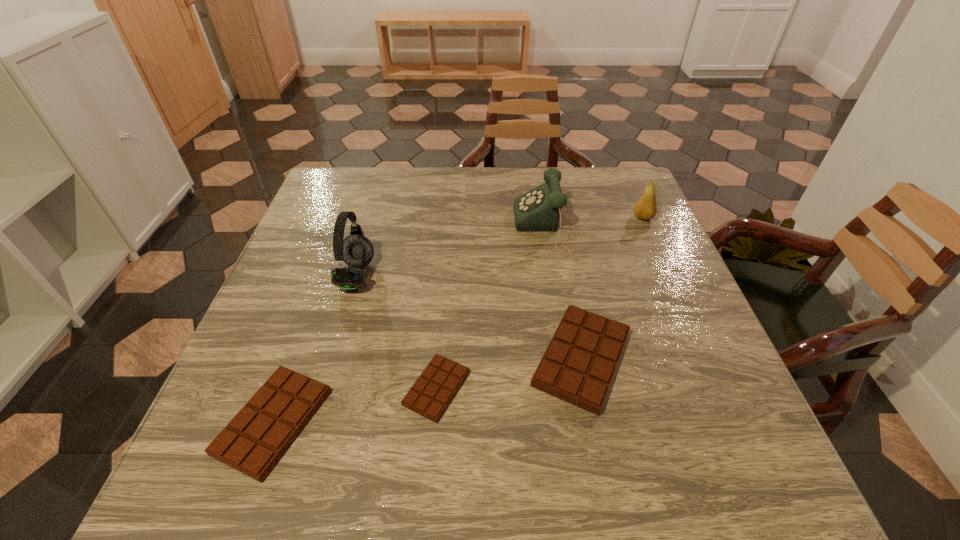
Locate an element on the screen. This screenshot has width=960, height=540. the second tallest candy bar is located at coordinates (253, 442).

Where is `the second shortest object`? The height and width of the screenshot is (540, 960). the second shortest object is located at coordinates (253, 442).

Locate an element on the screen. the second candy bar from right to left is located at coordinates (430, 395).

Identify the location of the shortest candy bar. The height and width of the screenshot is (540, 960). (430, 395).

Locate an element on the screen. the rightmost candy bar is located at coordinates tap(577, 367).

At what (x,y) coordinates should I click in order to perform the action: click on telephone. Please return your answer as a coordinate pair (x, y). This screenshot has height=540, width=960. Looking at the image, I should click on (539, 209).

The height and width of the screenshot is (540, 960). What are the coordinates of `headset` in the screenshot? It's located at (356, 250).

Find the location of a particular element. pear is located at coordinates (645, 208).

I want to click on free spot located 0.360m on the back of the leftmost candy bar, so click(x=336, y=249).

This screenshot has height=540, width=960. In order to click on vacant space located 0.170m on the right of the shortest candy bar in this screenshot , I will do `click(561, 388)`.